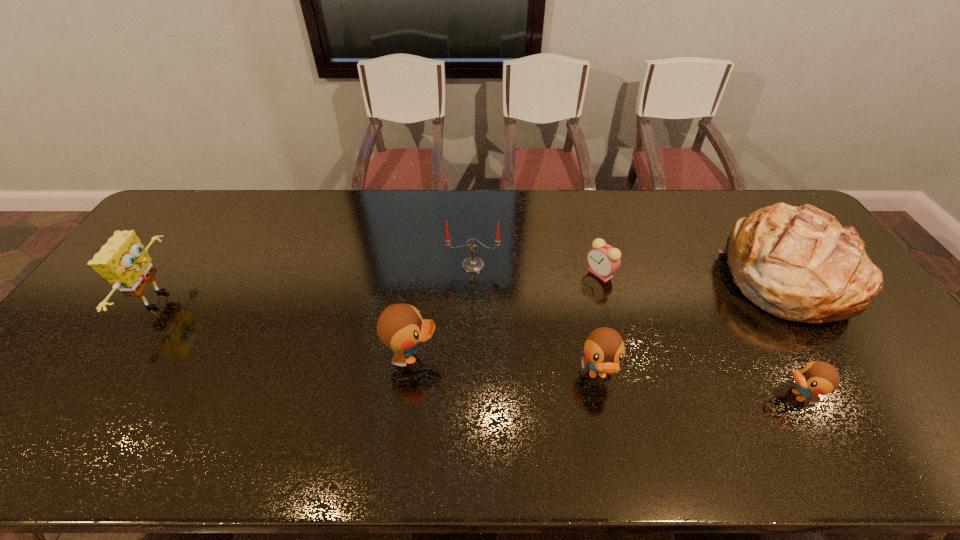
At what (x,y) coordinates should I click in order to perform the action: click on vacant space that satisfies the following two spatial constraints: 1. on the face of the alarm clock; 2. on the front-facing side of the fifth tallest object. Please return your answer as a coordinate pair (x, y). This screenshot has height=540, width=960. Looking at the image, I should click on (627, 375).

Where is `vacant space that satisfies the following two spatial constraints: 1. on the front side of the bread; 2. on the face of the sponge`? The image size is (960, 540). vacant space that satisfies the following two spatial constraints: 1. on the front side of the bread; 2. on the face of the sponge is located at coordinates (799, 299).

Find the location of `vacant space that satisfies the following two spatial constraints: 1. on the front-facing side of the candle; 2. on the front-facing side of the leftmost duck`. vacant space that satisfies the following two spatial constraints: 1. on the front-facing side of the candle; 2. on the front-facing side of the leftmost duck is located at coordinates (471, 356).